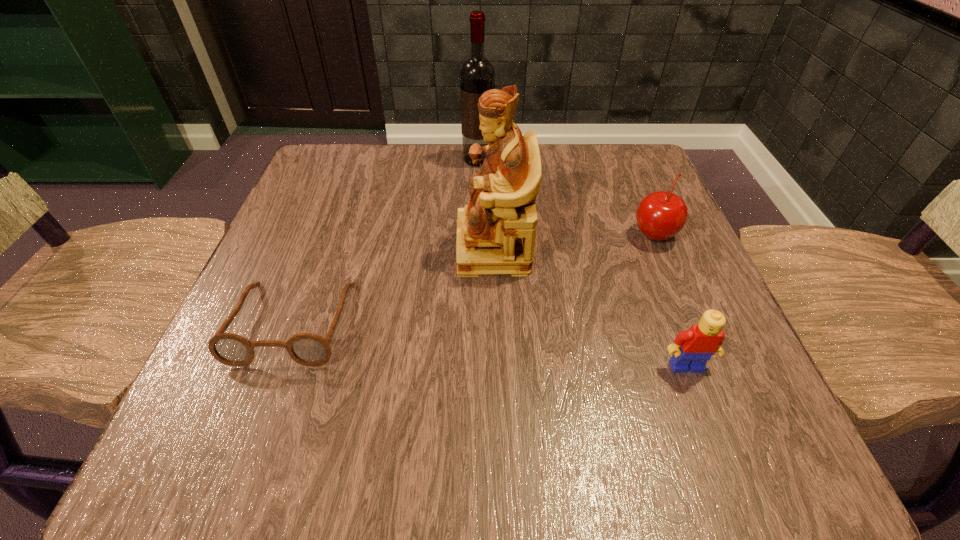
Locate an element on the screen. free space located 0.090m on the face of the Lego is located at coordinates (712, 436).

The height and width of the screenshot is (540, 960). What are the coordinates of `blank area located 0.100m on the back of the cherry` in the screenshot? It's located at (635, 188).

This screenshot has width=960, height=540. Identify the location of vacant space located on the front-facing side of the leftmost object. (265, 400).

At what (x,y) coordinates should I click in order to perform the action: click on object that is at the far edge. Please return your answer as a coordinate pair (x, y). The width and height of the screenshot is (960, 540). Looking at the image, I should click on (477, 74).

This screenshot has height=540, width=960. Identify the location of object that is at the left edge. (307, 349).

Find the location of a particular element. Image resolution: width=960 pixels, height=540 pixels. Lego at the right edge is located at coordinates (701, 341).

The width and height of the screenshot is (960, 540). I want to click on cherry present at the right edge, so pyautogui.click(x=661, y=215).

Find the location of a particular element. This screenshot has height=540, width=960. vacant space at the far edge is located at coordinates (455, 156).

The height and width of the screenshot is (540, 960). In order to click on vacant position at the near edge of the desktop in this screenshot , I will do `click(574, 457)`.

This screenshot has width=960, height=540. What are the coordinates of `vacant space at the left edge` in the screenshot? It's located at pos(306,286).